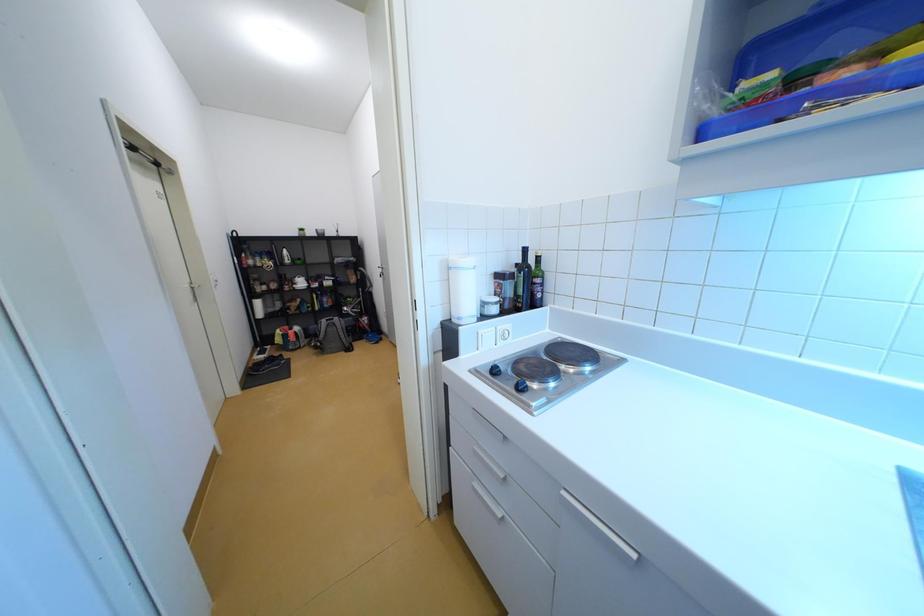
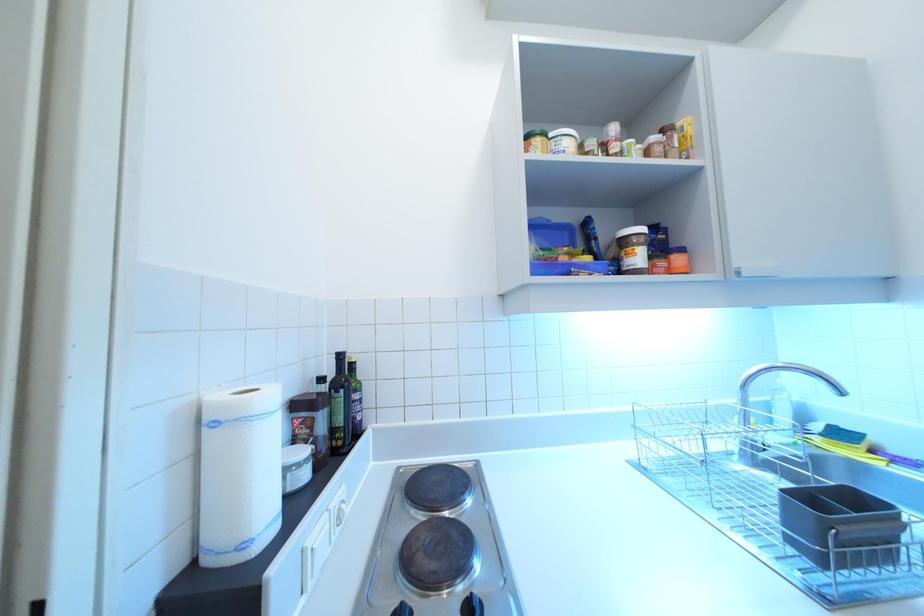
Question: The camera is either moving clockwise (left) or counter-clockwise (right) around the object. The first image is from the beginning of the video and the second image is from the end. Is the camera moving left or right when shooting the video?

Choices:
 (A) Left
 (B) Right

Answer: (A)